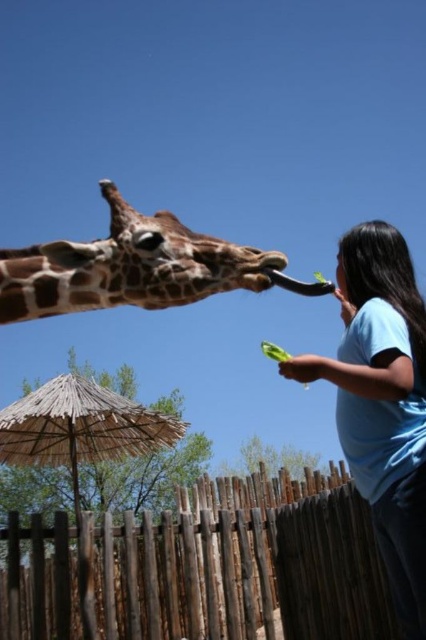
Can you confirm if blue cotton shirt at right is wider than spotted brown giraffe at center?

Incorrect, blue cotton shirt at right's width does not surpass spotted brown giraffe at center's.

Who is more forward, (x=399, y=611) or (x=207, y=292)?

Positioned in front is point (x=399, y=611).

The height and width of the screenshot is (640, 426). Find the location of `blue cotton shirt at right`. blue cotton shirt at right is located at coordinates (382, 401).

The width and height of the screenshot is (426, 640). Describe the element at coordinates (201, 573) in the screenshot. I see `brown wooden fence at lower center` at that location.

Does brown wooden fence at lower center appear on the left side of spotted brown giraffe at center?

Incorrect, brown wooden fence at lower center is not on the left side of spotted brown giraffe at center.

This screenshot has height=640, width=426. In order to click on brown wooden fence at lower center in this screenshot , I will do `click(201, 573)`.

Does brown wooden fence at lower center come behind blue cotton shirt at right?

Yes.

Locate an element on the screen. brown wooden fence at lower center is located at coordinates (201, 573).